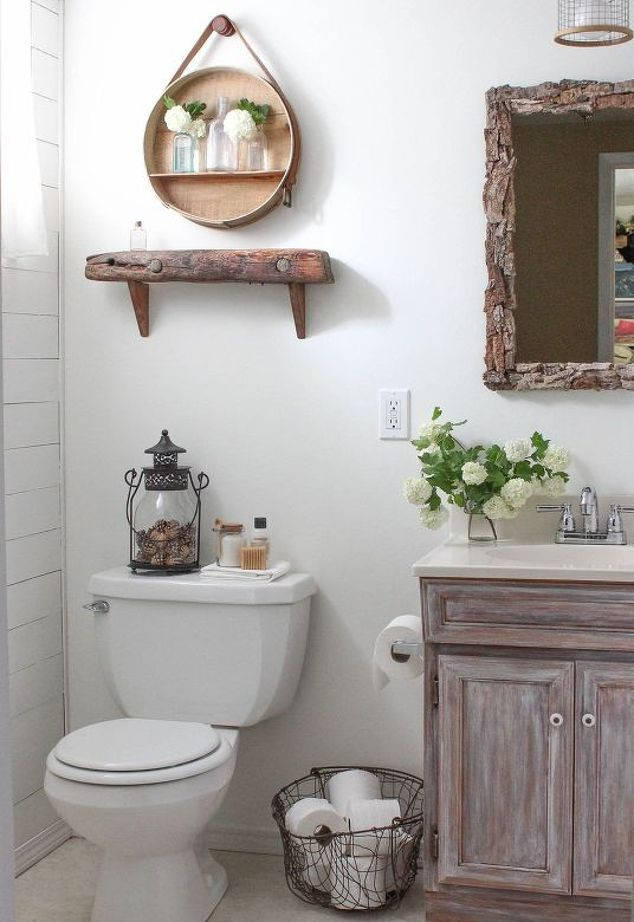
This screenshot has height=922, width=634. What are the coordinates of `back of toilet` in the screenshot? It's located at (209, 660), (153, 647).